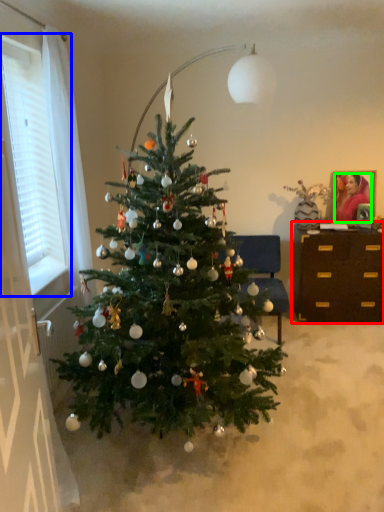
Question: Which object is positioned farthest from desk (highlighted by a red box)? Select from window (highlighted by a blue box) and person (highlighted by a green box).

Choices:
 (A) window
 (B) person

Answer: (A)